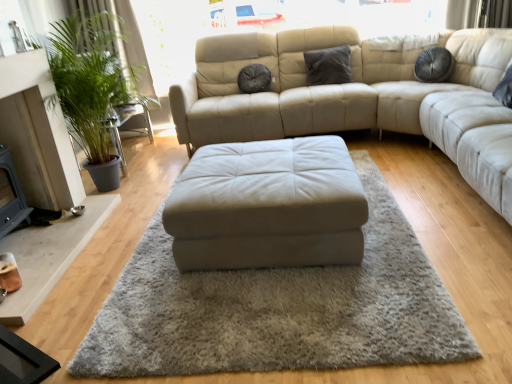
Question: Can you confirm if suede-like gray pillow at center, acting as the second pillow starting from the right, is shorter than beige leather ottoman at center?

Choices:
 (A) no
 (B) yes

Answer: (A)

Question: From the image's perspective, is suede-like gray pillow at center, acting as the second pillow starting from the right, on beige leather ottoman at center?

Choices:
 (A) yes
 (B) no

Answer: (A)

Question: Is suede-like gray pillow at center, acting as the second pillow starting from the right, completely or partially outside of beige leather ottoman at center?

Choices:
 (A) yes
 (B) no

Answer: (A)

Question: From a real-world perspective, is suede-like gray pillow at center, which appears as the 1th pillow when viewed from the left, below beige leather ottoman at center?

Choices:
 (A) no
 (B) yes

Answer: (A)

Question: Is suede-like gray pillow at center, acting as the second pillow starting from the right, thinner than beige leather ottoman at center?

Choices:
 (A) no
 (B) yes

Answer: (B)

Question: In the image, is dark gray fabric pillow at center, the 1th pillow in the right-to-left sequence, positioned in front of or behind beige leather ottoman at center?

Choices:
 (A) front
 (B) behind

Answer: (B)

Question: Considering the positions of dark gray fabric pillow at center, the 2th pillow viewed from the left, and beige leather ottoman at center in the image, is dark gray fabric pillow at center, the 2th pillow viewed from the left, taller or shorter than beige leather ottoman at center?

Choices:
 (A) short
 (B) tall

Answer: (A)

Question: From a real-world perspective, is dark gray fabric pillow at center, the 1th pillow in the right-to-left sequence, physically located above or below beige leather ottoman at center?

Choices:
 (A) below
 (B) above

Answer: (B)

Question: Considering the positions of point (318, 52) and point (251, 155), is point (318, 52) closer or farther from the camera than point (251, 155)?

Choices:
 (A) closer
 (B) farther

Answer: (B)

Question: Is beige leather ottoman at center wider or thinner than green leafy plant at left?

Choices:
 (A) wide
 (B) thin

Answer: (A)

Question: From a real-world perspective, is beige leather ottoman at center above or below green leafy plant at left?

Choices:
 (A) above
 (B) below

Answer: (B)

Question: Based on their sizes in the image, would you say beige leather ottoman at center is bigger or smaller than green leafy plant at left?

Choices:
 (A) small
 (B) big

Answer: (A)

Question: Considering their positions, is beige leather ottoman at center located in front of or behind green leafy plant at left?

Choices:
 (A) front
 (B) behind

Answer: (A)

Question: From the image's perspective, is beige leather ottoman at center above or below beige leather ottoman at center?

Choices:
 (A) above
 (B) below

Answer: (A)

Question: Is beige leather ottoman at center inside or outside of beige leather ottoman at center?

Choices:
 (A) outside
 (B) inside

Answer: (A)